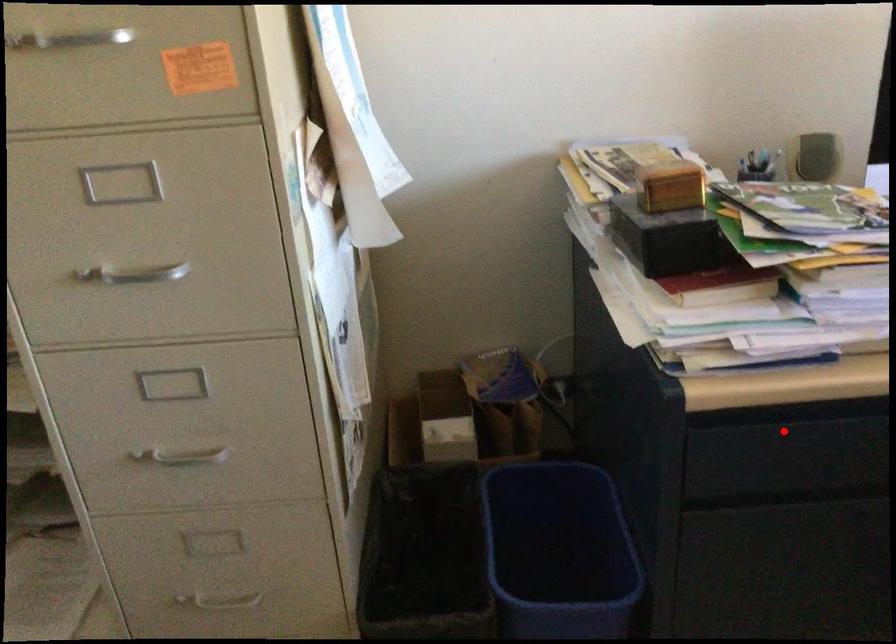
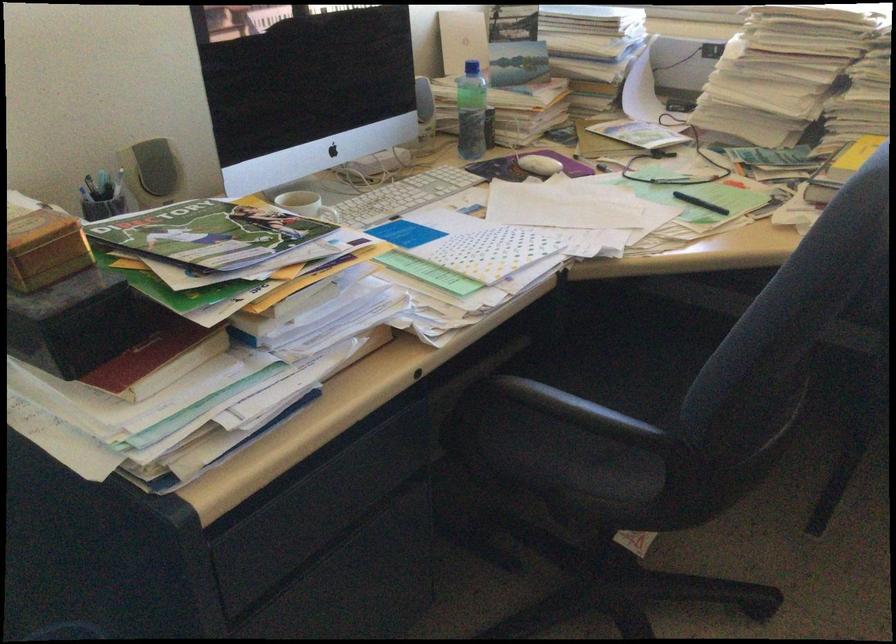
Question: I am providing you with two images of the same scene from different viewpoints. In image1, a red point is highlighted. Considering the same 3D point in image2, which of the following is correct?

Choices:
 (A) It is closer
 (B) It is farther

Answer: (A)